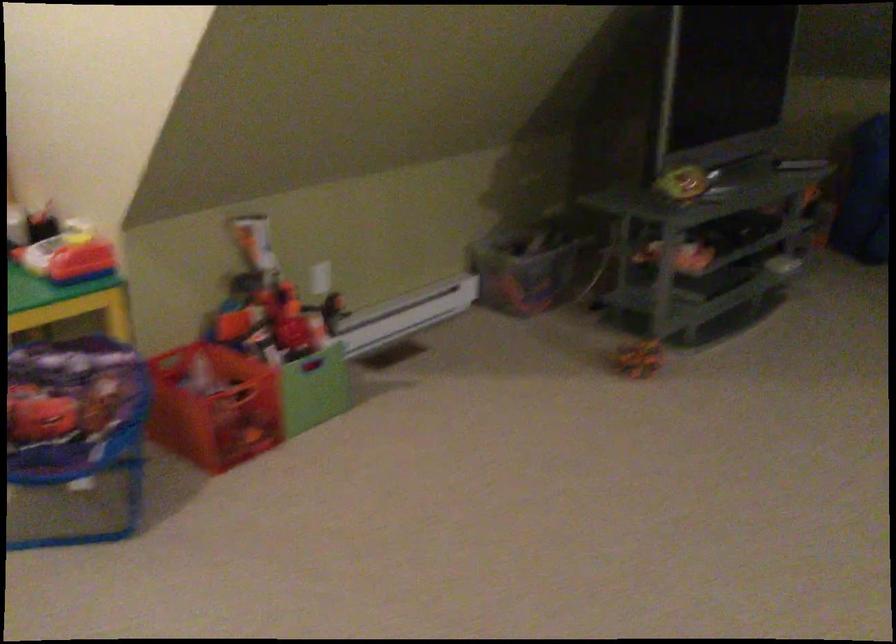
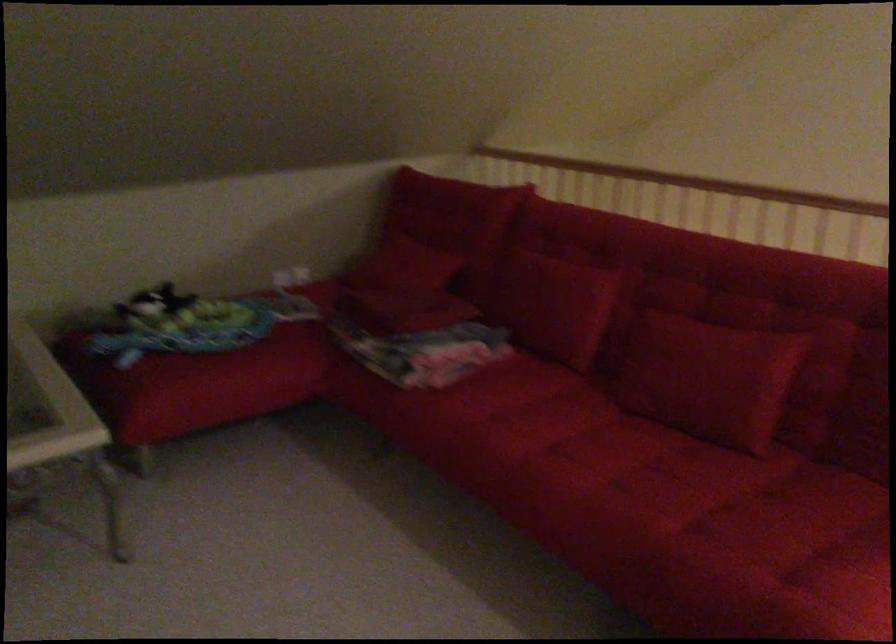
Question: The images are taken continuously from a first-person perspective. In which direction is your viewpoint rotating?

Choices:
 (A) Left
 (B) Right
 (C) Up
 (D) Down

Answer: (B)